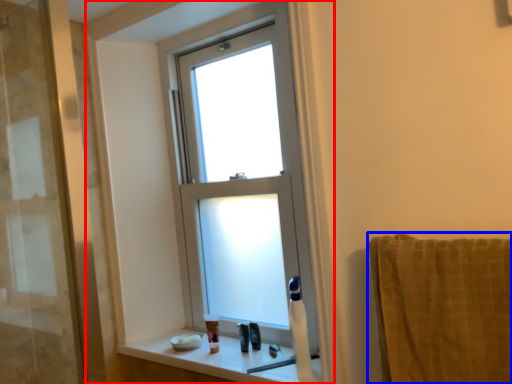
Question: Which point is closer to the camera, window frame (highlighted by a red box) or towel/napkin (highlighted by a blue box)?

Choices:
 (A) window frame
 (B) towel/napkin

Answer: (B)